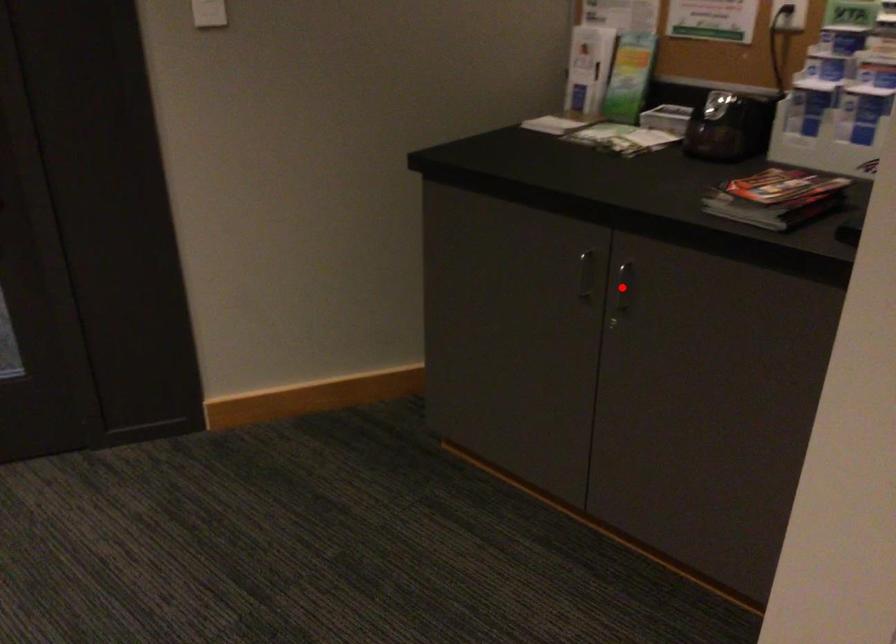
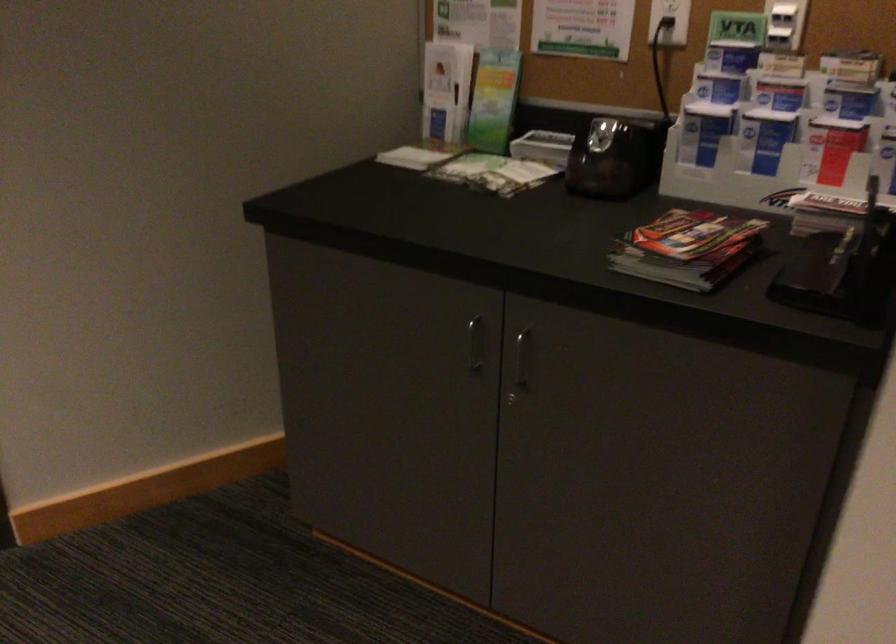
Find the pixel in the second image that matches the highlighted location in the first image.

(521, 357)